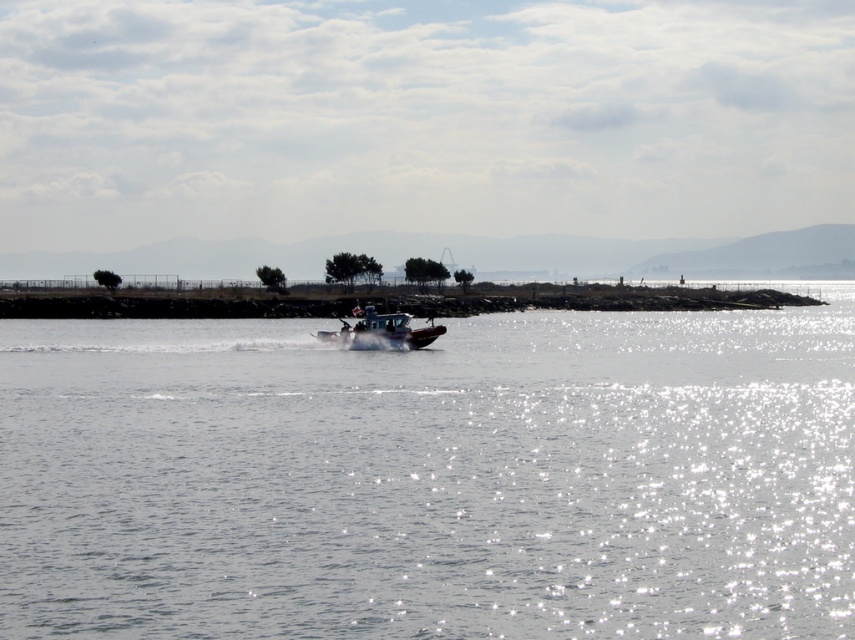
You are a drone operator trying to capture the clear water at center in the image. The drone is currently at point (431,477). Is the clear water at center located directly below the drone?

The point (431,477) corresponds to the clear water at center, so yes, the clear water at center is directly below the drone at that point.

You are standing on the rocky jetty and see the clear water at center and the metallic gray boat at center. Which object is closer to your right side?

The clear water at center is closer to your right side since it is positioned to the right of the metallic gray boat at center.

You are standing at the edge of the jetty and want to reach the point marked at coordinates point (590, 396). Your maximum walking distance is 35 meters. Can you reach it without exceeding your limit?

The point (590, 396) is 40.23 meters away from the viewer, which exceeds your maximum walking distance of 35 meters. You cannot reach it without exceeding your limit.